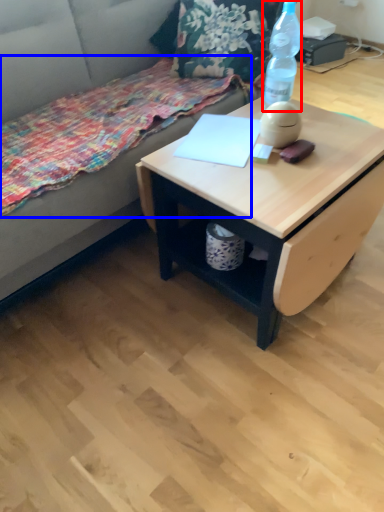
Question: Which object is closer to the camera taking this photo, bottle (highlighted by a red box) or blanket (highlighted by a blue box)?

Choices:
 (A) bottle
 (B) blanket

Answer: (B)